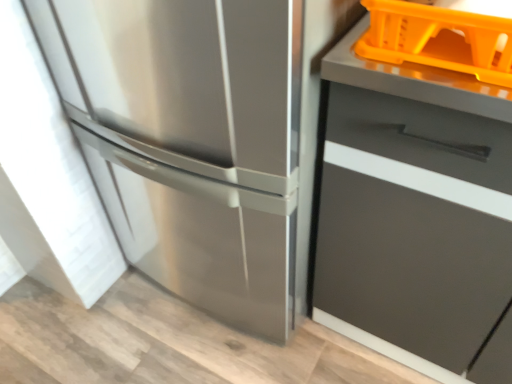
Question: Is orange plastic basket at upper right taller or shorter than stainless steel refrigerator at left?

Choices:
 (A) short
 (B) tall

Answer: (A)

Question: Does point (422, 18) appear closer or farther from the camera than point (169, 152)?

Choices:
 (A) farther
 (B) closer

Answer: (B)

Question: Which is nearer to the stainless steel refrigerator at left?

Choices:
 (A) matte gray drawer at right
 (B) orange plastic basket at upper right

Answer: (A)

Question: Which of these objects is positioned closest to the matte gray drawer at right?

Choices:
 (A) stainless steel refrigerator at left
 (B) orange plastic basket at upper right

Answer: (A)